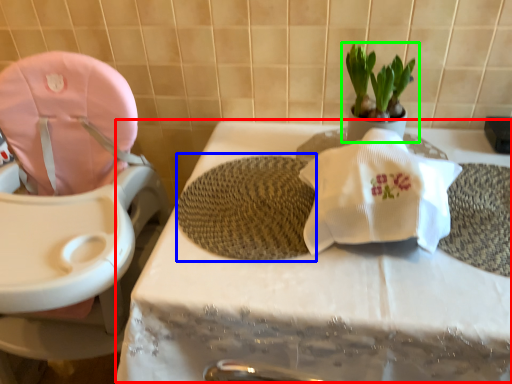
Question: Estimate the real-world distances between objects in this image. Which object is farther from table (highlighted by a red box), bath mat (highlighted by a blue box) or houseplant (highlighted by a green box)?

Choices:
 (A) bath mat
 (B) houseplant

Answer: (B)